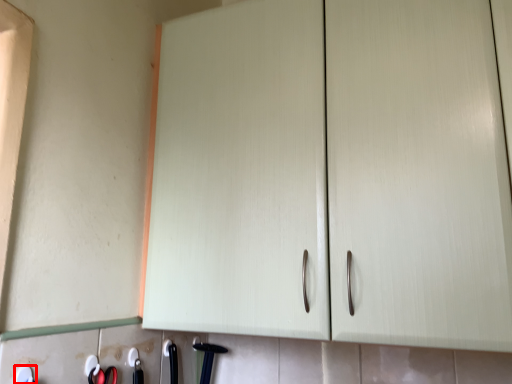
Question: Where is tool (annotated by the red box) located in relation to door handle in the image?

Choices:
 (A) right
 (B) left

Answer: (B)